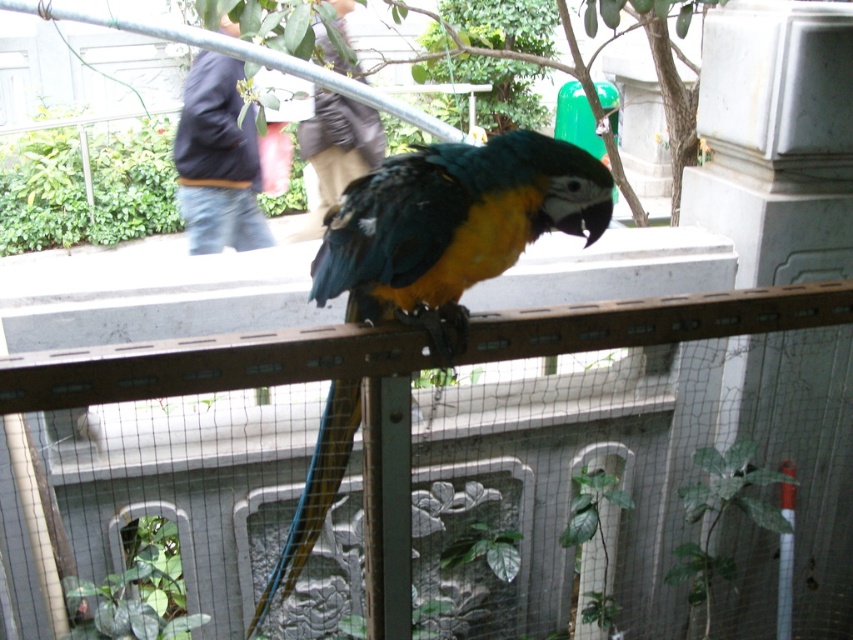
Does metal mesh fence at center have a greater height compared to shiny multicolored parrot at center?

No, metal mesh fence at center is not taller than shiny multicolored parrot at center.

Does metal mesh fence at center have a smaller size compared to shiny multicolored parrot at center?

Indeed, metal mesh fence at center has a smaller size compared to shiny multicolored parrot at center.

What do you see at coordinates (265, 385) in the screenshot?
I see `metal mesh fence at center` at bounding box center [265, 385].

Where is `metal mesh fence at center`? The width and height of the screenshot is (853, 640). metal mesh fence at center is located at coordinates (265, 385).